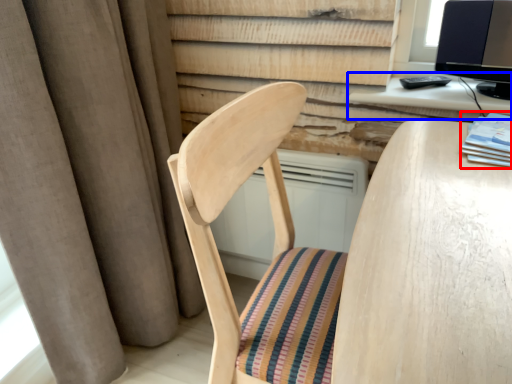
Question: Which object is further to the camera taking this photo, book (highlighted by a red box) or computer desk (highlighted by a blue box)?

Choices:
 (A) book
 (B) computer desk

Answer: (B)